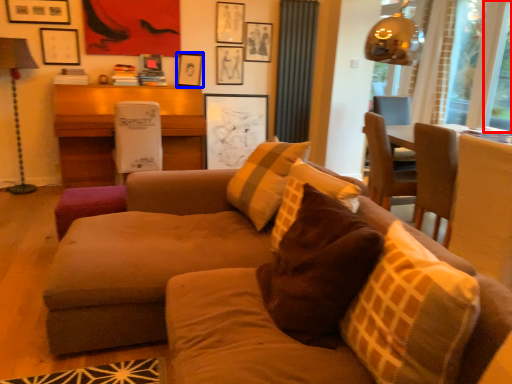
Question: Which object is closer to the camera taking this photo, window screen (highlighted by a red box) or picture frame (highlighted by a blue box)?

Choices:
 (A) window screen
 (B) picture frame

Answer: (A)